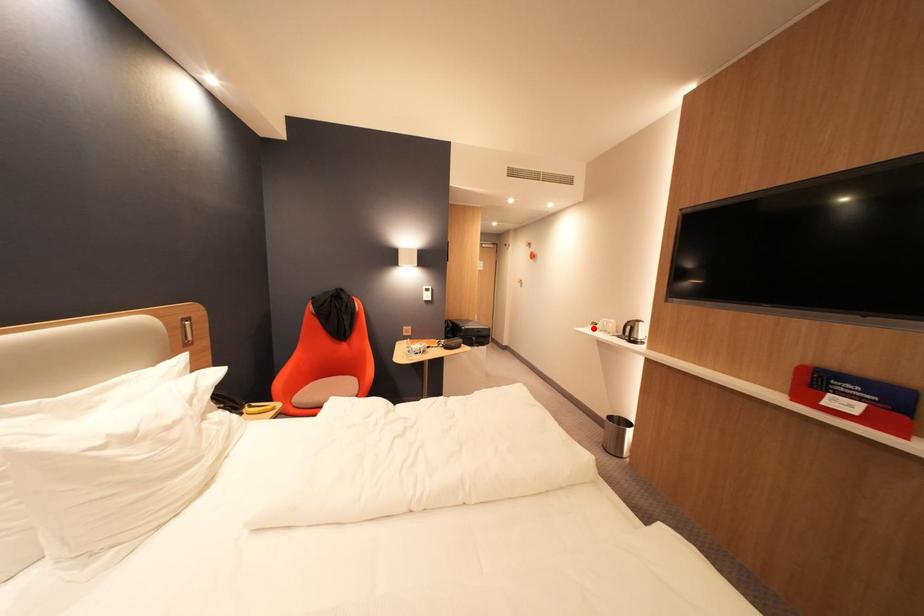
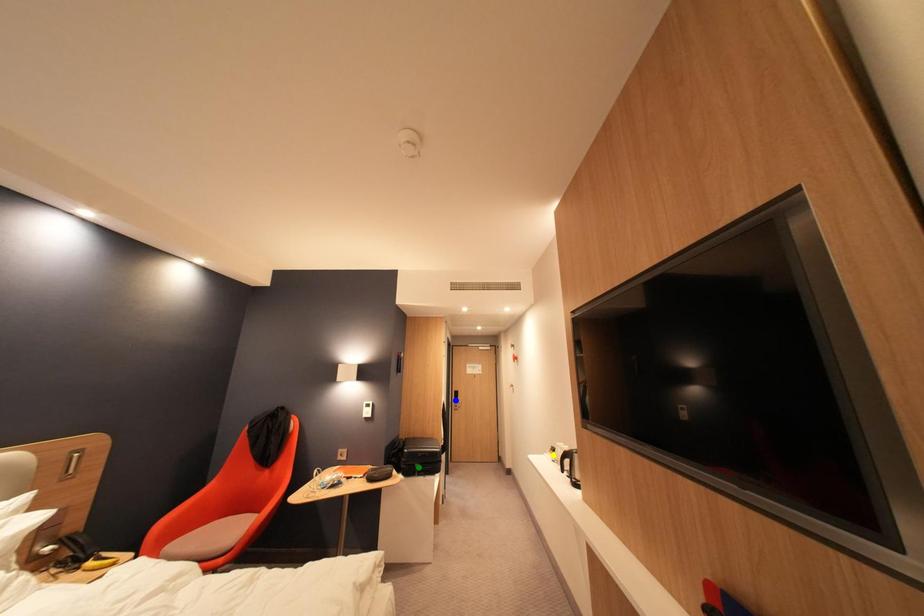
Question: I am providing you with two images of the same scene from different viewpoints. A red point is marked on the first image. You are given multiple points on the second image. Which point in image 2 represents the same 3d spot as the red point in image 1?

Choices:
 (A) blue point
 (B) yellow point
 (C) green point

Answer: (B)